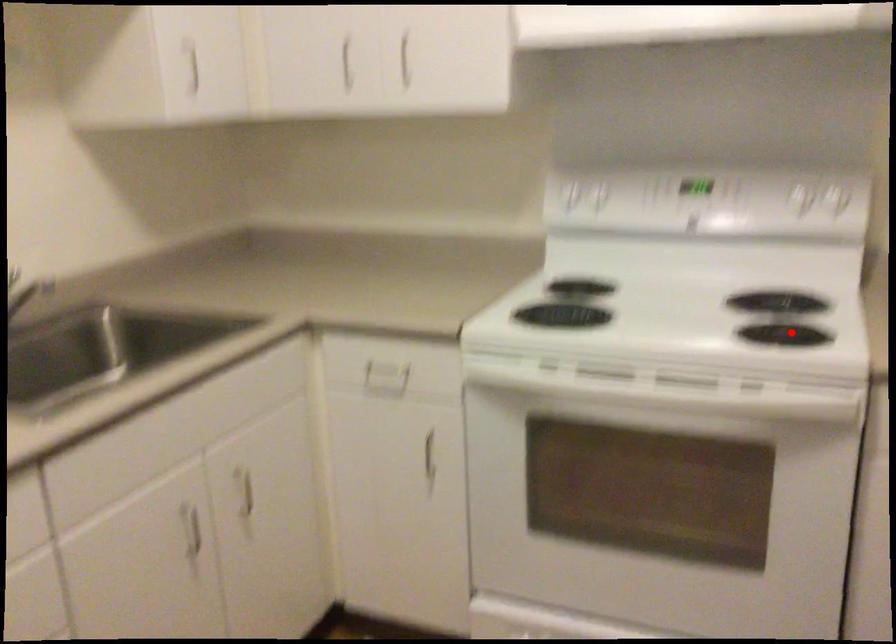
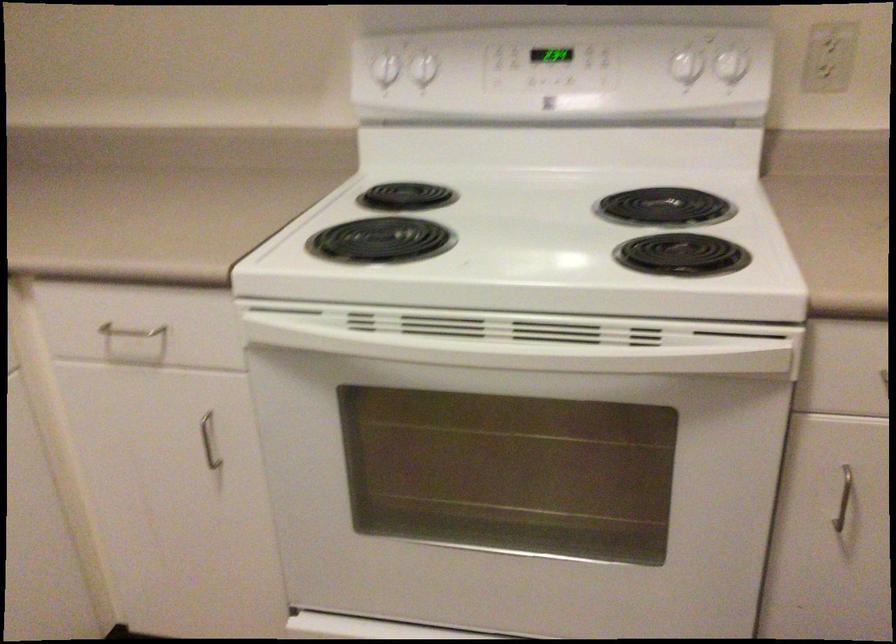
In the second image, find the point that corresponds to the highlighted location in the first image.

(682, 254)